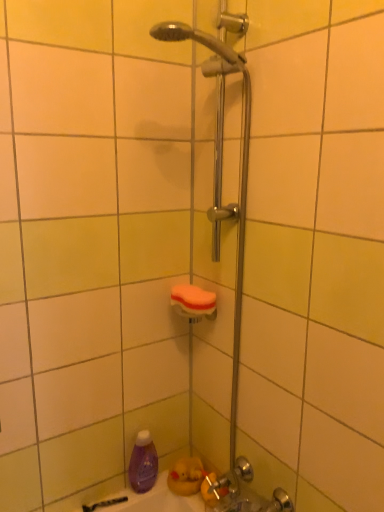
Question: Could you tell me if orange sponge at center is facing purple matte bottle at lower left?

Choices:
 (A) yes
 (B) no

Answer: (B)

Question: Does orange sponge at center contain purple matte bottle at lower left?

Choices:
 (A) no
 (B) yes

Answer: (A)

Question: Is orange sponge at center positioned behind purple matte bottle at lower left?

Choices:
 (A) yes
 (B) no

Answer: (B)

Question: Is orange sponge at center bigger than purple matte bottle at lower left?

Choices:
 (A) yes
 (B) no

Answer: (B)

Question: Is orange sponge at center to the left of purple matte bottle at lower left from the viewer's perspective?

Choices:
 (A) yes
 (B) no

Answer: (B)

Question: Is orange sponge at center thinner than purple matte bottle at lower left?

Choices:
 (A) no
 (B) yes

Answer: (A)

Question: Is purple matte bottle at lower left not inside orange sponge at center?

Choices:
 (A) yes
 (B) no

Answer: (A)

Question: Does purple matte bottle at lower left have a smaller size compared to orange sponge at center?

Choices:
 (A) yes
 (B) no

Answer: (B)

Question: Can you confirm if purple matte bottle at lower left is taller than orange sponge at center?

Choices:
 (A) yes
 (B) no

Answer: (A)

Question: Can you confirm if purple matte bottle at lower left is positioned to the right of orange sponge at center?

Choices:
 (A) yes
 (B) no

Answer: (B)

Question: Can you confirm if purple matte bottle at lower left is wider than orange sponge at center?

Choices:
 (A) no
 (B) yes

Answer: (A)

Question: Does purple matte bottle at lower left have a larger size compared to orange sponge at center?

Choices:
 (A) no
 (B) yes

Answer: (B)

Question: Would you say purple matte bottle at lower left is inside or outside orange sponge at center?

Choices:
 (A) inside
 (B) outside

Answer: (B)